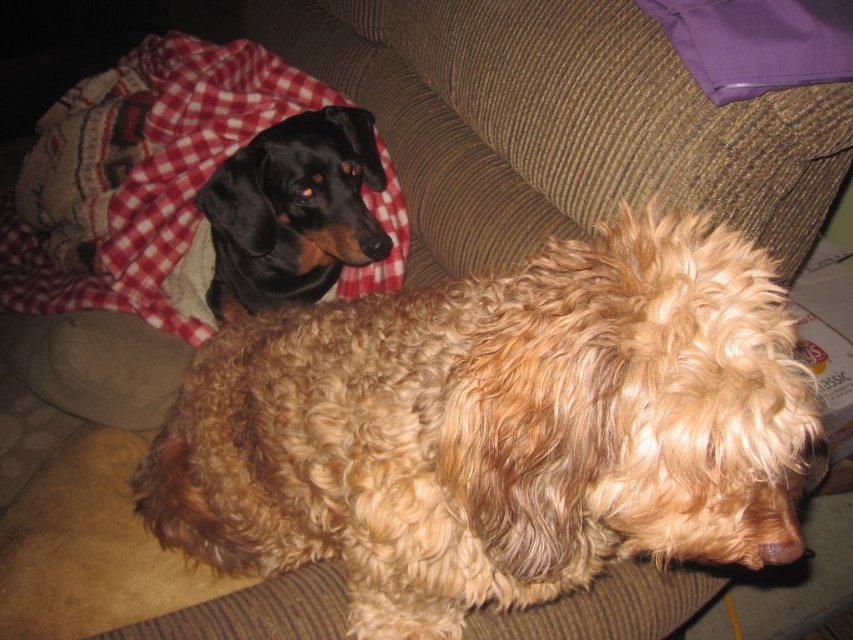
You are a dog owner who wants to ensure both pets have enough space on the couch. Given the presence of the red checkered blanket at upper left and the curly golden fur dog at center, which object takes up more vertical space?

The red checkered blanket at upper left takes up more vertical space since the curly golden fur dog at center is not as tall as it.

You are standing in front of the couch with two dogs. You see a red checkered blanket at upper left. Can you confirm if the point at coordinates (164, 177) corresponds to the location of the red checkered blanket at upper left?

Yes, the point at coordinates (164, 177) corresponds to the location of the red checkered blanket at upper left as stated in the Objects Description.

You are standing in front of the couch where the two dogs are resting. There is a point marked at coordinates (498, 428). Which dog is this point located on?

The point at coordinates (498, 428) is located on the curly golden fur dog at center.